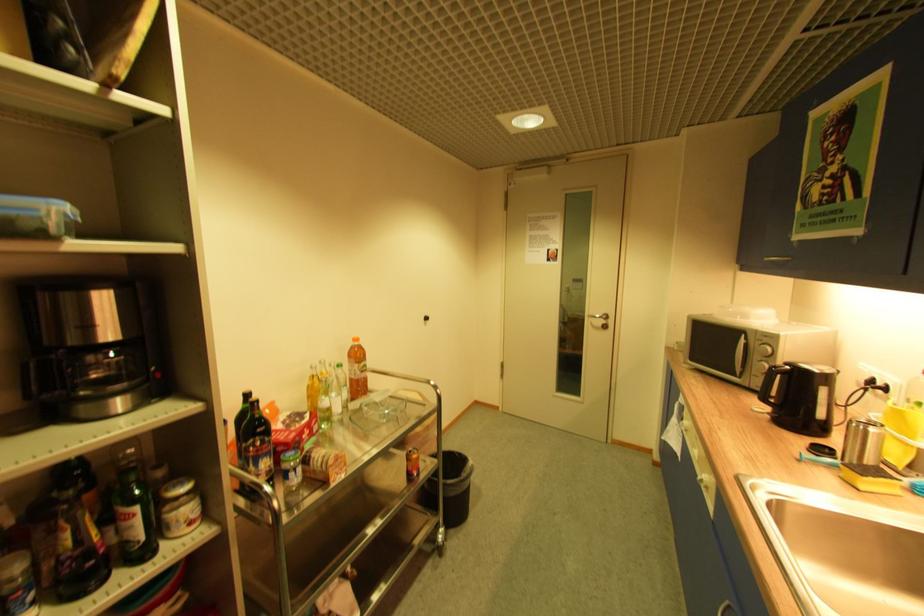
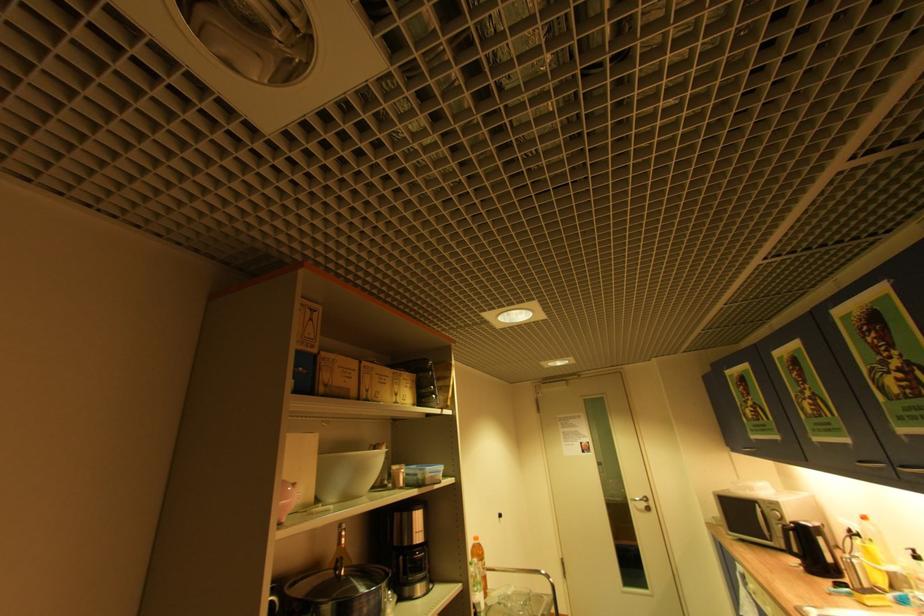
Locate, in the second image, the point that corresponds to (x=878, y=382) in the first image.

(856, 532)